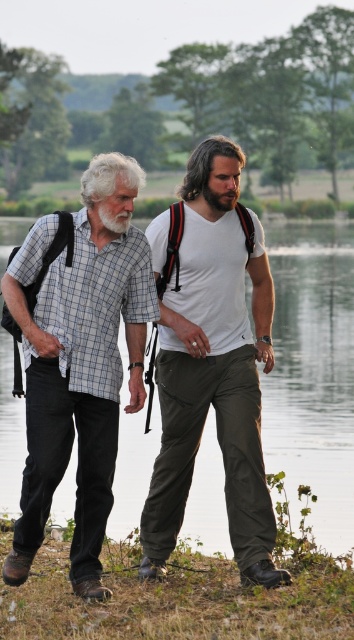
Based on the photo, is transparent water at center further to the viewer compared to white matte t-shirt at center?

Yes, transparent water at center is further from the viewer.

Does transparent water at center lie in front of white matte t-shirt at center?

No, transparent water at center is behind white matte t-shirt at center.

This screenshot has width=354, height=640. What do you see at coordinates (311, 371) in the screenshot?
I see `transparent water at center` at bounding box center [311, 371].

I want to click on transparent water at center, so click(x=311, y=371).

Does transparent water at center appear on the right side of brown fuzzy beard at center?

No, transparent water at center is not to the right of brown fuzzy beard at center.

Is point (4, 369) positioned before point (206, 193)?

No, it is behind (206, 193).

Which is in front, point (218, 529) or point (230, 195)?

Positioned in front is point (230, 195).

Image resolution: width=354 pixels, height=640 pixels. Identify the location of transparent water at center. point(311,371).

Is checkered fabric shirt at left above brown fuzzy beard at center?

Actually, checkered fabric shirt at left is below brown fuzzy beard at center.

Can you confirm if checkered fabric shirt at left is positioned to the left of brown fuzzy beard at center?

Yes, checkered fabric shirt at left is to the left of brown fuzzy beard at center.

At what (x,y) coordinates should I click in order to perform the action: click on checkered fabric shirt at left. Please return your answer as a coordinate pair (x, y). This screenshot has width=354, height=640. Looking at the image, I should click on (80, 362).

Find the location of a particular element. The width and height of the screenshot is (354, 640). checkered fabric shirt at left is located at coordinates (80, 362).